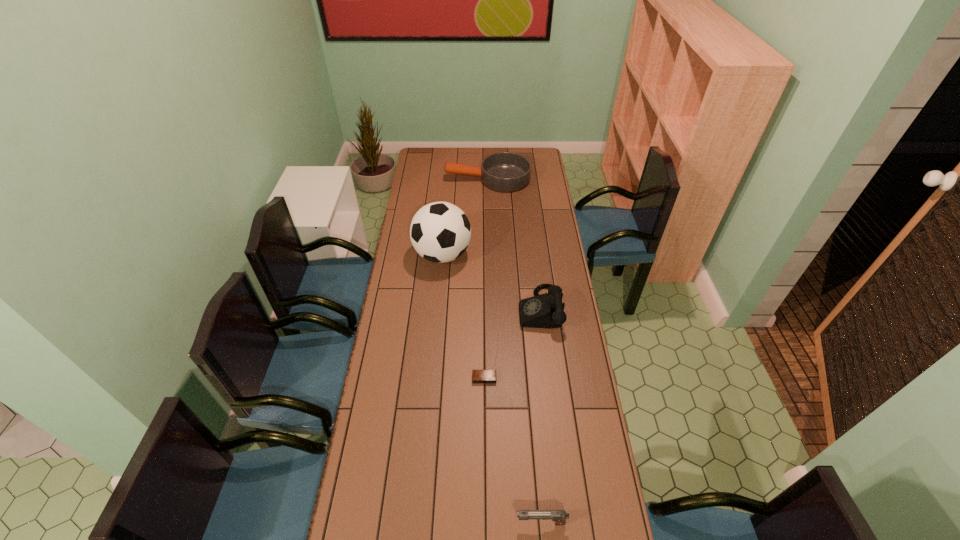
Where is `object that is positioned at the left edge`? object that is positioned at the left edge is located at coordinates (440, 232).

This screenshot has width=960, height=540. Find the location of `telephone that is at the right edge`. telephone that is at the right edge is located at coordinates (546, 310).

Find the location of a particular element. pan that is at the right edge is located at coordinates (505, 171).

Find the location of a particular element. Image resolution: width=960 pixels, height=540 pixels. gun present at the right edge is located at coordinates (559, 516).

You are a GUI agent. You are given a task and a screenshot of the screen. Output one action in this format:
    pyautogui.click(x=<x>, y=<y>)
    Task: Click on the object present at the far right corner
    The image size is (960, 540).
    Given the screenshot: What is the action you would take?
    pyautogui.click(x=505, y=171)

In the image, there is a desktop. Where is `free space at the far edge`? The height and width of the screenshot is (540, 960). free space at the far edge is located at coordinates (446, 153).

In the image, there is a desktop. Identify the location of vacant space at the left edge. This screenshot has width=960, height=540. (434, 195).

This screenshot has height=540, width=960. In order to click on vacant space at the right edge in this screenshot , I will do `click(554, 428)`.

Find the location of a particular element. The width and height of the screenshot is (960, 540). vacant area between the fourth nearest object and the shortest object is located at coordinates [x=464, y=316].

The width and height of the screenshot is (960, 540). I want to click on free space between the gun and the fourth farthest object, so click(513, 450).